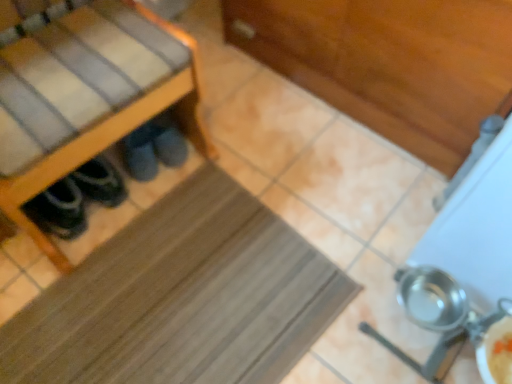
Locate an element on the screen. This screenshot has height=384, width=512. free location in front of wooden shoe rack at left is located at coordinates (114, 301).